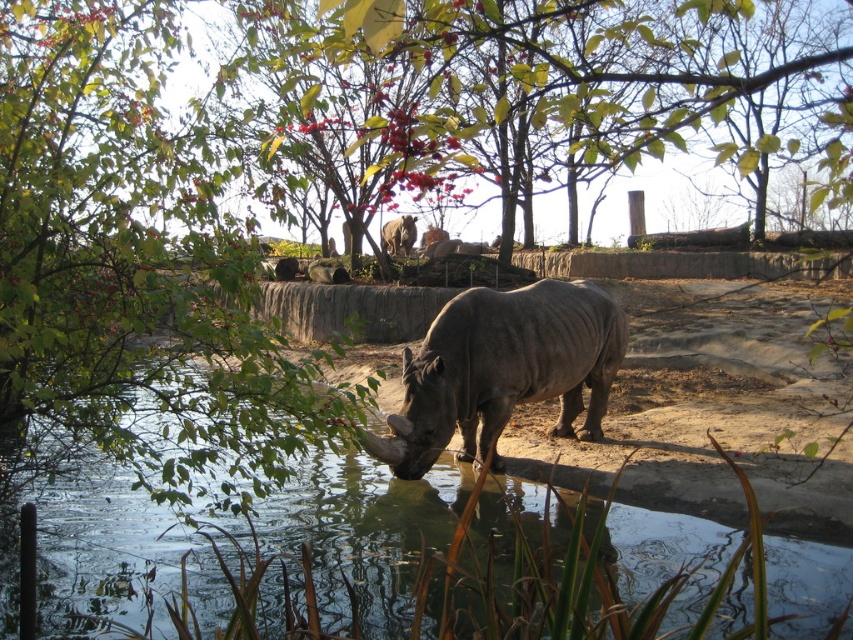
Question: Which of the following is the closest to the observer?

Choices:
 (A) gray matte rhinoceros at center
 (B) gray matte rhinoceros at upper center

Answer: (A)

Question: Estimate the real-world distances between objects in this image. Which object is farther from the gray matte rhinoceros at upper center?

Choices:
 (A) gray matte rhinoceros at center
 (B) transparent water at center

Answer: (B)

Question: Can you confirm if transparent water at center is positioned above gray matte rhinoceros at center?

Choices:
 (A) no
 (B) yes

Answer: (B)

Question: Which is nearer to the gray matte rhinoceros at upper center?

Choices:
 (A) transparent water at center
 (B) gray matte rhinoceros at center

Answer: (B)

Question: Is transparent water at center to the left of gray matte rhinoceros at center from the viewer's perspective?

Choices:
 (A) yes
 (B) no

Answer: (A)

Question: From the image, what is the correct spatial relationship of gray matte rhinoceros at center in relation to gray matte rhinoceros at upper center?

Choices:
 (A) left
 (B) right

Answer: (B)